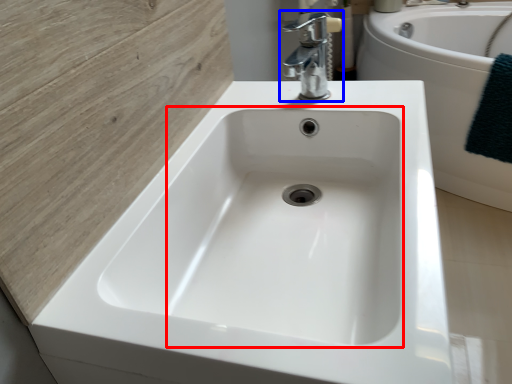
Question: Which of the following is the farthest to the observer, sink (highlighted by a red box) or tap (highlighted by a blue box)?

Choices:
 (A) sink
 (B) tap

Answer: (B)